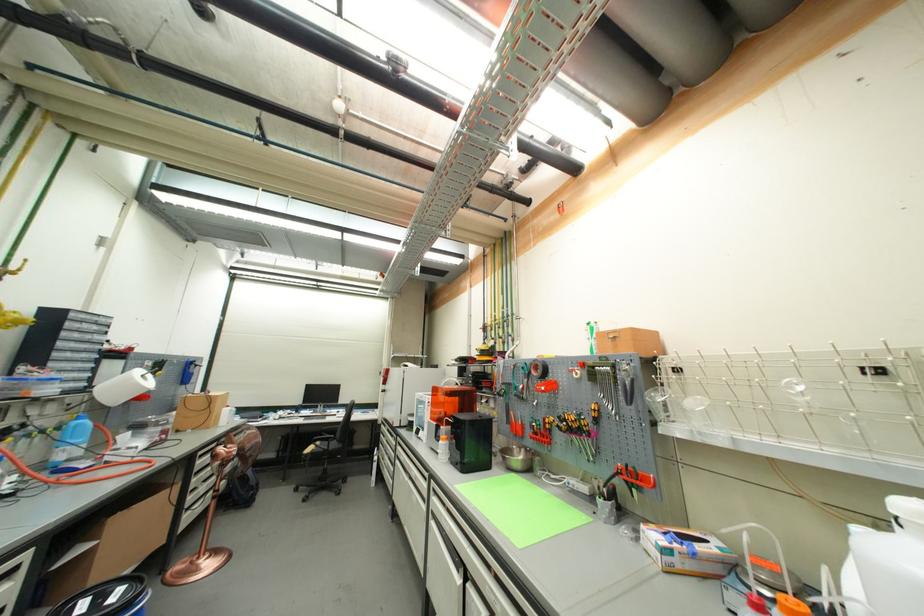
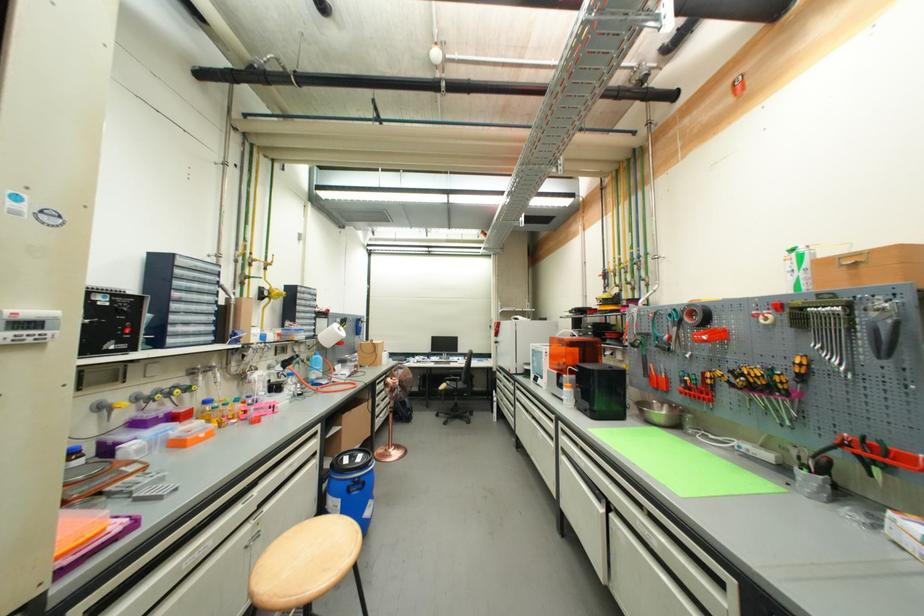
Question: What movement of the cameraman would produce the second image?

Choices:
 (A) Left
 (B) Right
 (C) Forward
 (D) Backward

Answer: (A)